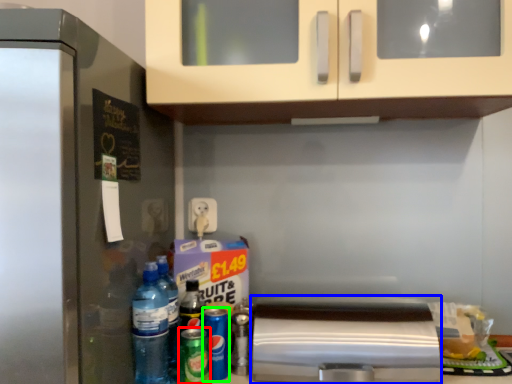
Question: Estimate the real-world distances between objects in this image. Which object is closer to beer (highlighted by a red box), appliance (highlighted by a blue box) or beer (highlighted by a green box)?

Choices:
 (A) appliance
 (B) beer

Answer: (B)